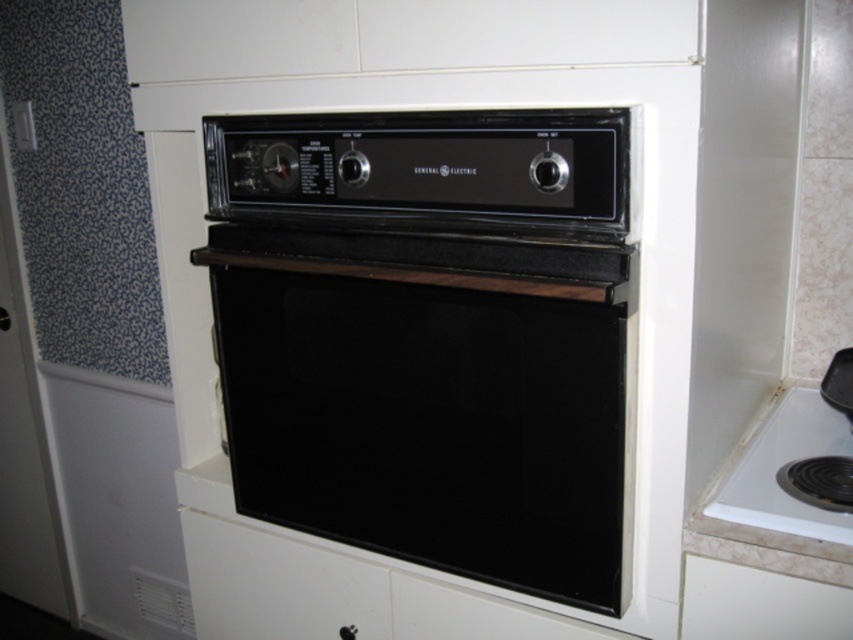
You are a kitchen designer planning to install a new appliance. You need to ensure that the black glass oven at center and the white glossy cooktop at lower right are placed at appropriate heights for ergonomic use. Based on their heights, which appliance should be positioned lower to the ground?

The white glossy cooktop at lower right should be positioned lower to the ground since the black glass oven at center has a greater height compared to it.

You are a kitchen designer and need to ensure proper spacing between the black glass oven at center and the white glossy cooktop at lower right. Based on the image, which side of the oven is closer to the cooktop?

The black glass oven at center is to the left of the white glossy cooktop at lower right, so the right side of the oven is closer to the cooktop.